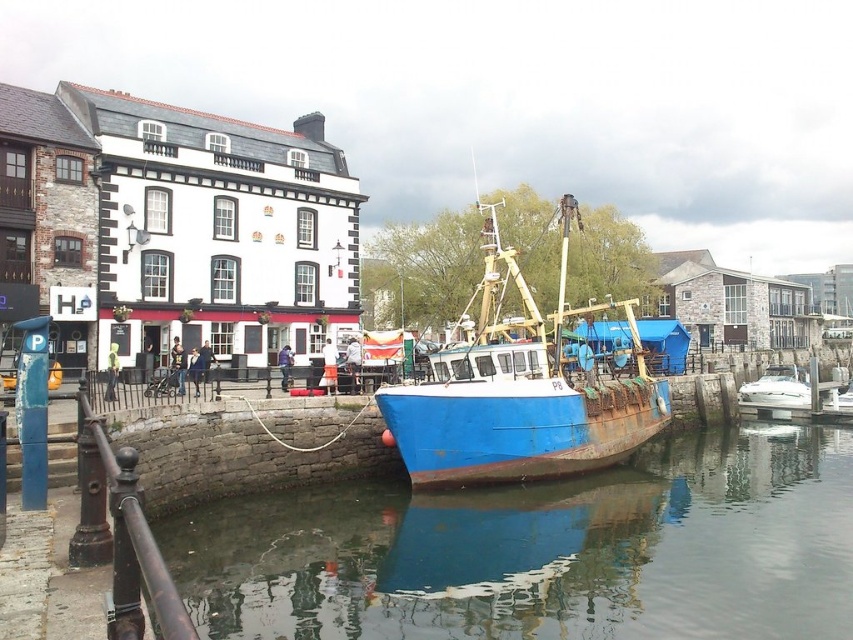
Between blue metallic water at lower center and rusty blue boat at center, which one is positioned higher?

rusty blue boat at center

Which of these two, blue metallic water at lower center or rusty blue boat at center, stands shorter?

With less height is blue metallic water at lower center.

Who is more forward, [677,576] or [462,397]?

Point [677,576] is in front.

Locate an element on the screen. The image size is (853, 640). blue metallic water at lower center is located at coordinates (543, 550).

Locate an element on the screen. The image size is (853, 640). blue metallic water at lower center is located at coordinates (543, 550).

Can you confirm if blue metallic water at lower center is bigger than white glossy boat at right?

Indeed, blue metallic water at lower center has a larger size compared to white glossy boat at right.

Does point (529, 508) lie behind point (799, 392)?

No, it is not.

This screenshot has width=853, height=640. What are the coordinates of `blue metallic water at lower center` in the screenshot? It's located at (543, 550).

How far apart are rusty blue boat at center and white glossy boat at right?

The distance of rusty blue boat at center from white glossy boat at right is 32.44 meters.

Does rusty blue boat at center have a smaller size compared to white glossy boat at right?

No, rusty blue boat at center is not smaller than white glossy boat at right.

Which is behind, point (428, 454) or point (755, 403)?

The point (755, 403) is more distant.

The width and height of the screenshot is (853, 640). I want to click on rusty blue boat at center, so click(525, 385).